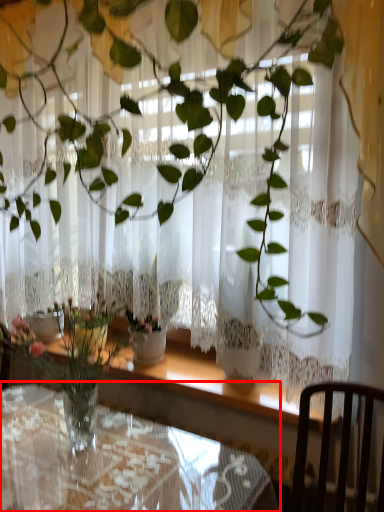
Question: From the image's perspective, where is table (annotated by the red box) located relative to chair?

Choices:
 (A) below
 (B) above

Answer: (A)